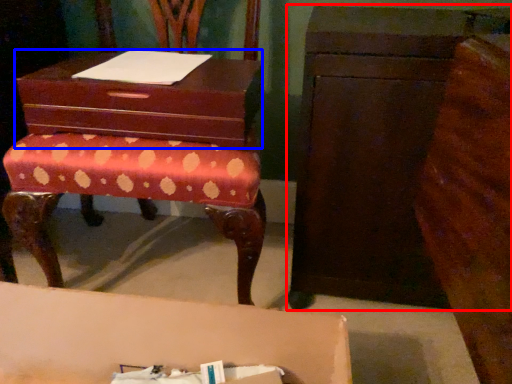
Question: Which object is further to the camera taking this photo, chest of drawers (highlighted by a red box) or storage box (highlighted by a blue box)?

Choices:
 (A) chest of drawers
 (B) storage box

Answer: (B)